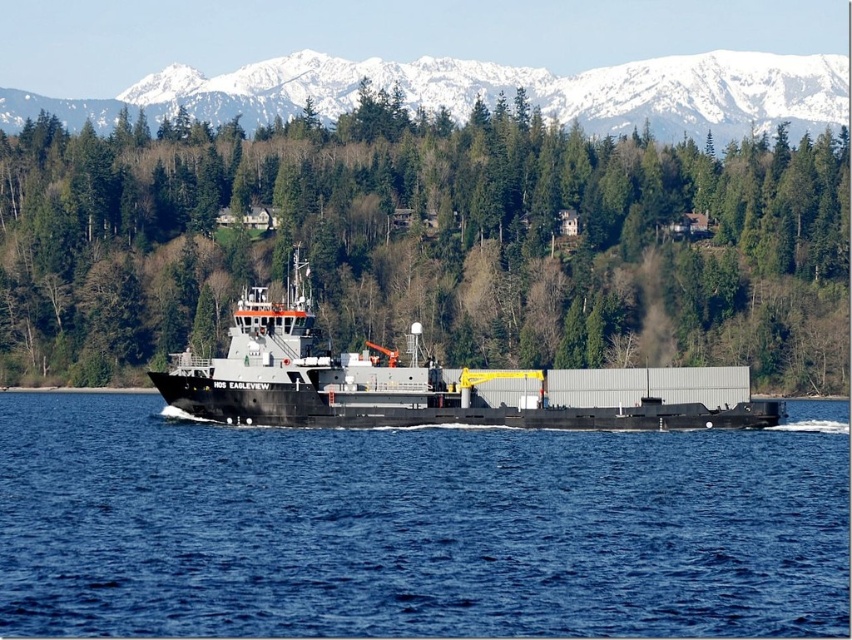
You are a sailor on the HOS EAGLEVIEW and you need to navigate through the blue water at center. Since the black matte barge at center is blocking your path, can you go under it?

The blue water at center is positioned under the black matte barge at center, so yes, you can navigate under the black matte barge at center through the blue water at center.

You are a pilot flying a small plane that requires a safe distance of at least 200 meters from any obstacles. You spot the black matte barge at center and the snowy white mountain at upper center in your path. Can you safely fly between them without violating the safety distance rule?

The black matte barge at center is 214.68 meters away from the snowy white mountain at upper center. Since the required safe distance is 200 meters, the distance between them is sufficient, so you can safely fly between them without violating the safety distance rule.